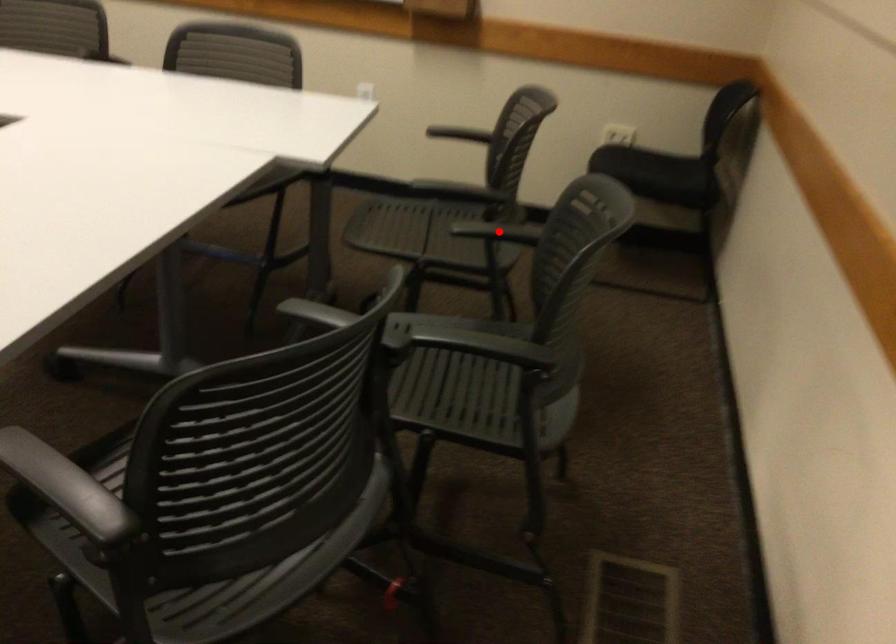
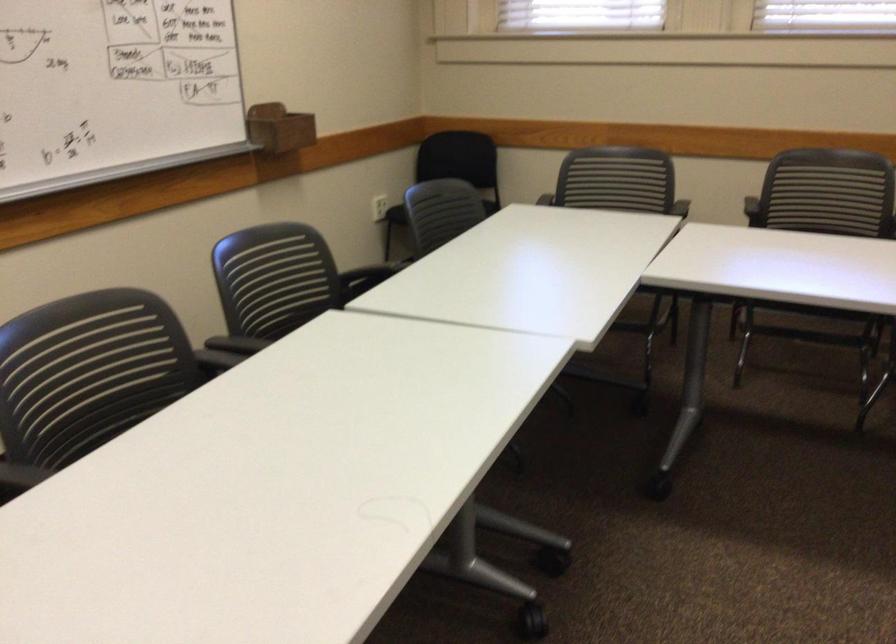
Question: I am providing you with two images of the same scene from different viewpoints. A red point is marked on the first image. At the location where the point appears in image 1, is it still visible in image 2?

Choices:
 (A) Yes
 (B) No

Answer: (B)